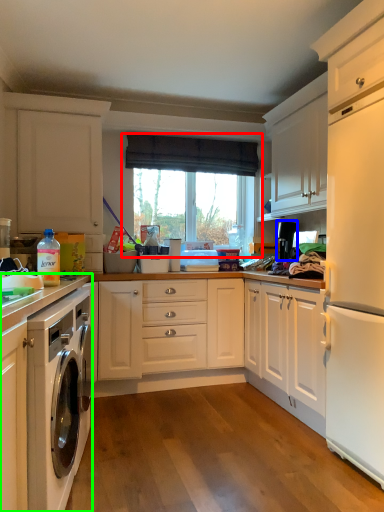
Question: Which is farther away from window (highlighted by a red box)? appliance (highlighted by a blue box) or cabinetry (highlighted by a green box)?

Choices:
 (A) appliance
 (B) cabinetry

Answer: (B)